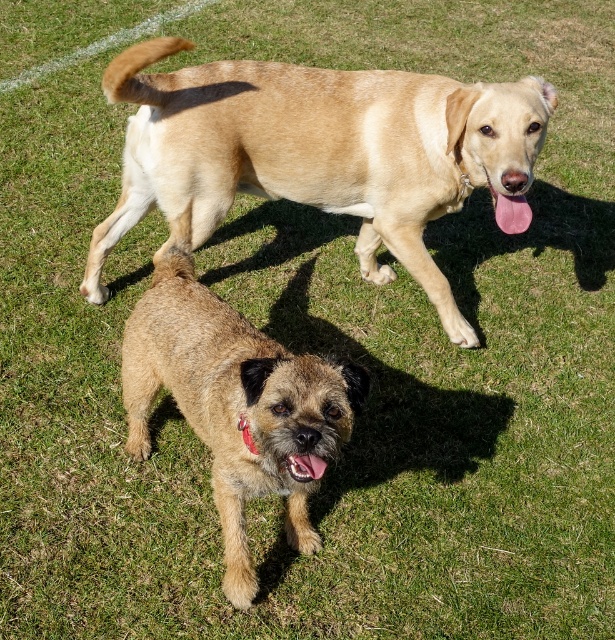
Question: Does light brown fur at upper center appear on the left side of pink glossy tongue at lower center?

Choices:
 (A) yes
 (B) no

Answer: (A)

Question: Does brown shaggy dog at center have a larger size compared to pink glossy tongue at lower center?

Choices:
 (A) no
 (B) yes

Answer: (B)

Question: Which object is farther from the camera taking this photo?

Choices:
 (A) pink glossy tongue at lower center
 (B) light brown fur at upper center
 (C) brown shaggy dog at center

Answer: (B)

Question: Which object is the farthest from the light brown fur at upper center?

Choices:
 (A) brown shaggy dog at center
 (B) pink glossy tongue at lower center

Answer: (B)

Question: Can you confirm if light brown fur at upper center is positioned below pink glossy tongue at lower center?

Choices:
 (A) yes
 (B) no

Answer: (B)

Question: Which of the following is the closest to the observer?

Choices:
 (A) brown shaggy dog at center
 (B) pink glossy tongue at lower center

Answer: (A)